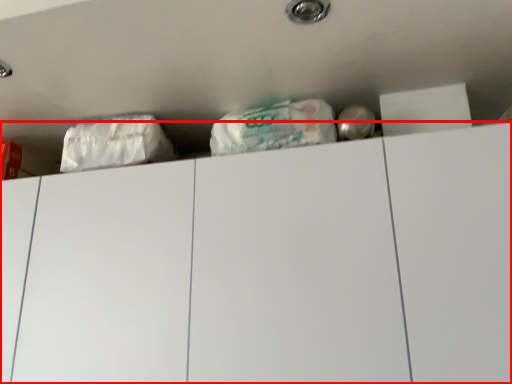
Question: From the image's perspective, what is the correct spatial positioning of drawer (annotated by the red box) in reference to plastic bag?

Choices:
 (A) below
 (B) above

Answer: (A)